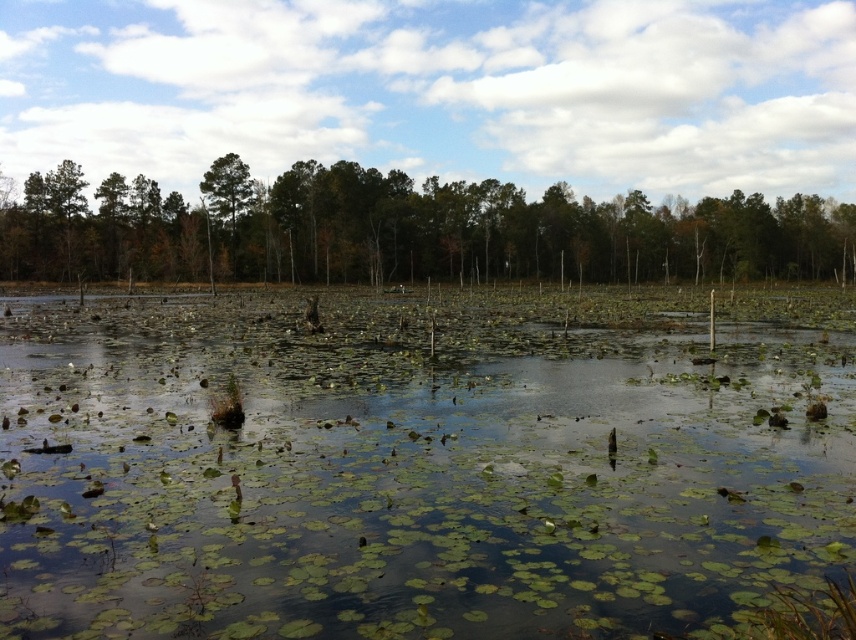
Consider the image. You are a small frog trying to jump from the green leafy water at center to the green leafy trees at center. Can you make the jump without touching the water? Please explain your reasoning based on their widths.

The green leafy water at center has a lesser width compared to green leafy trees at center. Since the frog needs to jump from the narrower green leafy water to the wider green leafy trees, it is possible to make the jump without touching the water if the distance between them is within the frog s jumping capability. However, the exact feasibility depends on the actual distance between the two areas, which isn t specified here.

You are a drone operator tasked with capturing aerial footage of the wetland. The green leafy water at center and the green leafy trees at center are your main subjects. Given that your drone has a maximum camera zoom range of 60 meters, can you capture both subjects in a single frame without moving the drone?

The green leafy water at center and green leafy trees at center are 61.99 meters apart, which exceeds the drone camera zoom range of 60 meters. Therefore, you cannot capture both subjects in a single frame without moving the drone.

You are a bird flying over the wetland scene. You see the green leafy water at center and the green leafy trees at center. Which one do you think is smaller in size?

The green leafy water at center has a smaller size compared to the green leafy trees at center, so the green leafy water at center is smaller.